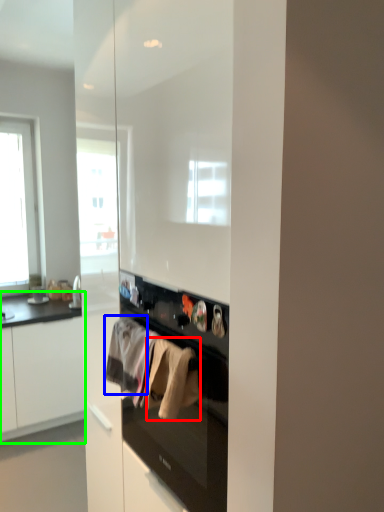
Question: Which is farther away from clothing (highlighted by a red box)? clothing (highlighted by a blue box) or cabinetry (highlighted by a green box)?

Choices:
 (A) clothing
 (B) cabinetry

Answer: (B)